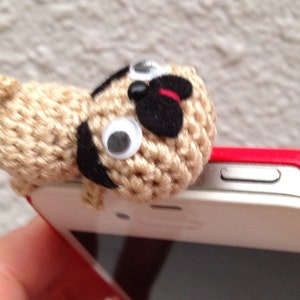
Find the location of a particular element. The width and height of the screenshot is (300, 300). rug is located at coordinates (240, 80).